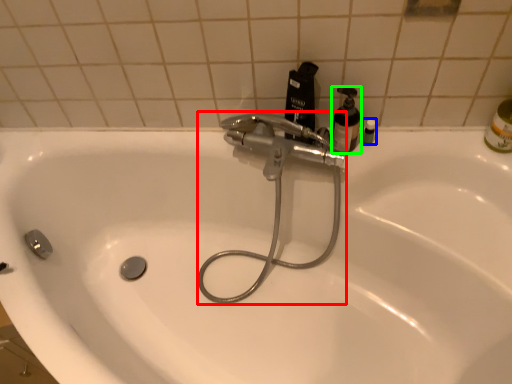
Question: Which object is the farthest from plumbing fixture (highlighted by a red box)? Choose among these: toiletry (highlighted by a blue box) or mouthwash (highlighted by a green box).

Choices:
 (A) toiletry
 (B) mouthwash

Answer: (A)